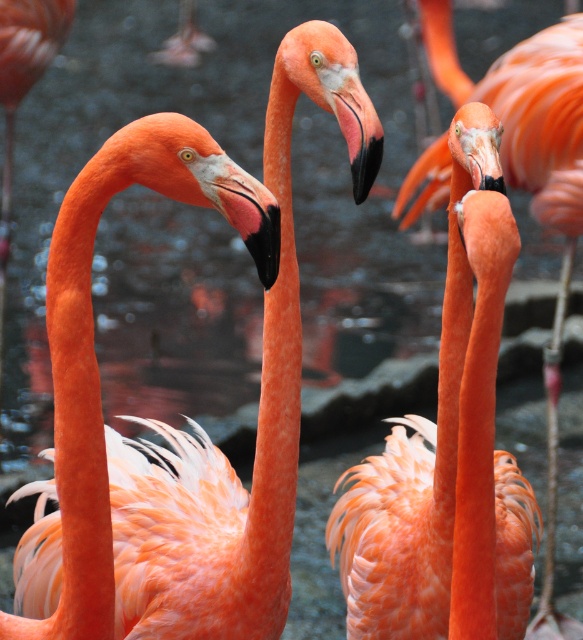
You are a birdwatcher observing the flamingos. You notice the orange feathered flamingo at center and the matte black beak at center. Which object is closer to you?

The orange feathered flamingo at center is closer to you because the matte black beak at center is behind it.